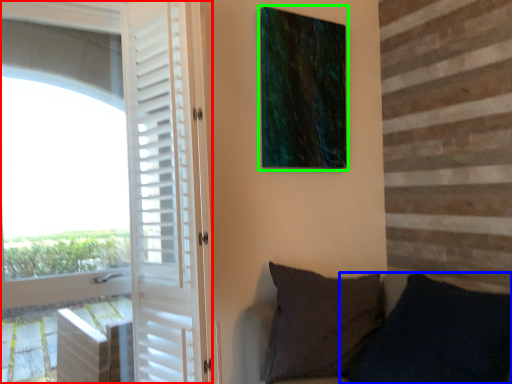
Question: Estimate the real-world distances between objects in this image. Which object is farther from door (highlighted by a red box), pillow (highlighted by a blue box) or picture frame (highlighted by a green box)?

Choices:
 (A) pillow
 (B) picture frame

Answer: (A)